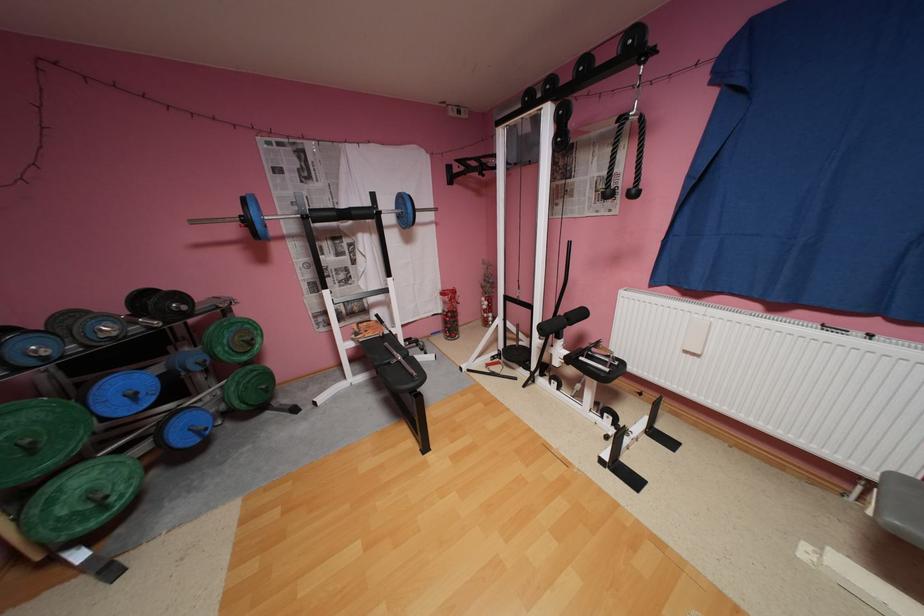
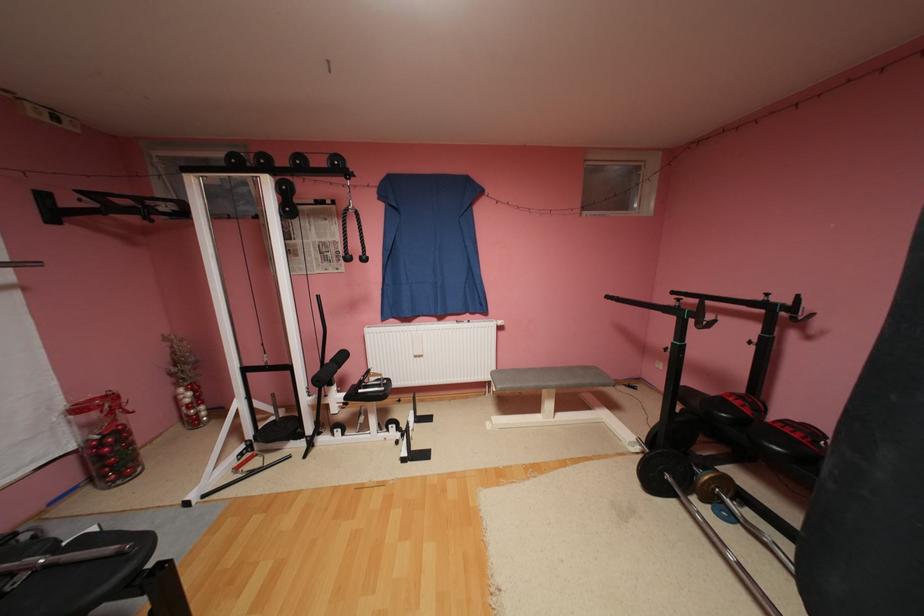
Question: The camera is either moving clockwise (left) or counter-clockwise (right) around the object. The first image is from the beginning of the video and the second image is from the end. Is the camera moving left or right when shooting the video?

Choices:
 (A) Left
 (B) Right

Answer: (A)